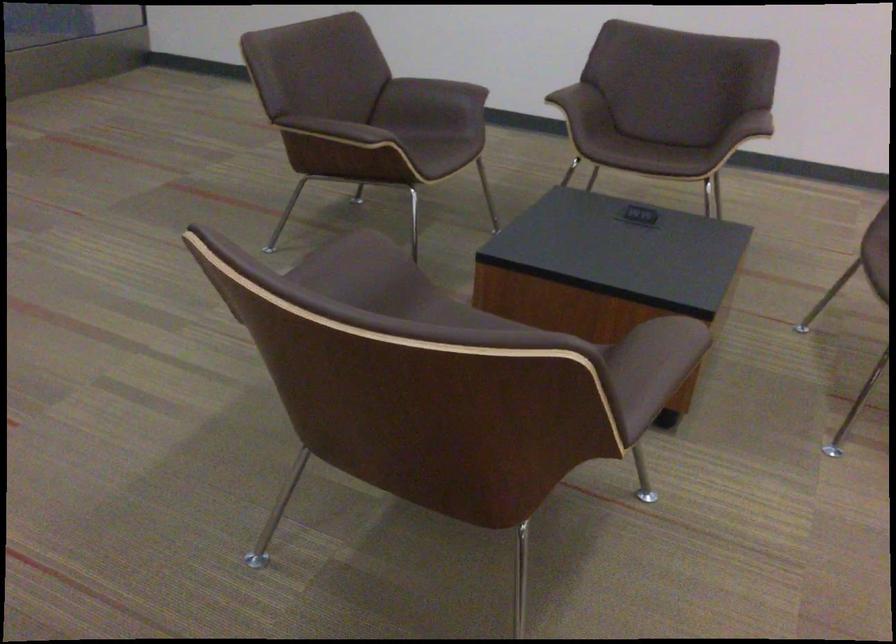
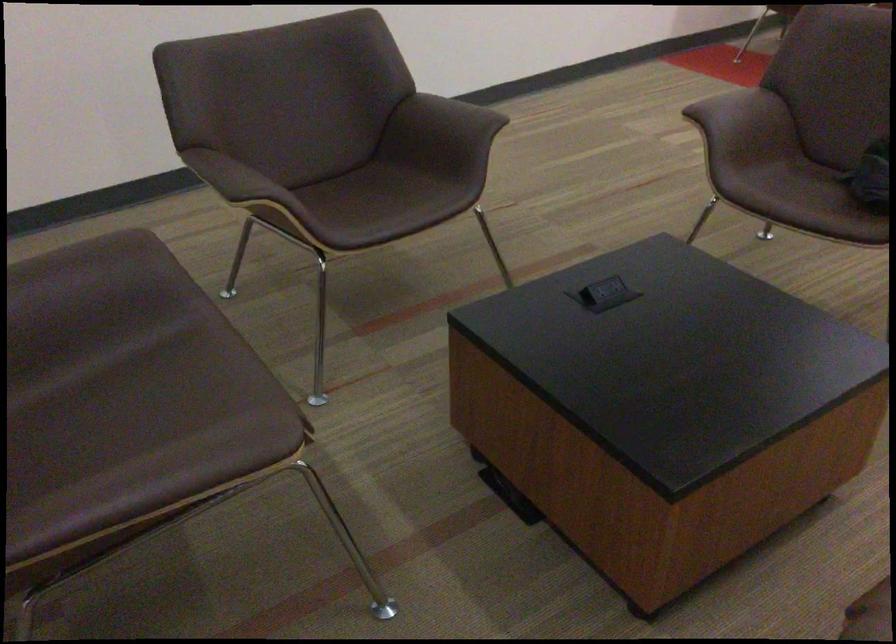
In the second image, find the point that corresponds to the point at 423,129 in the first image.

(80, 364)